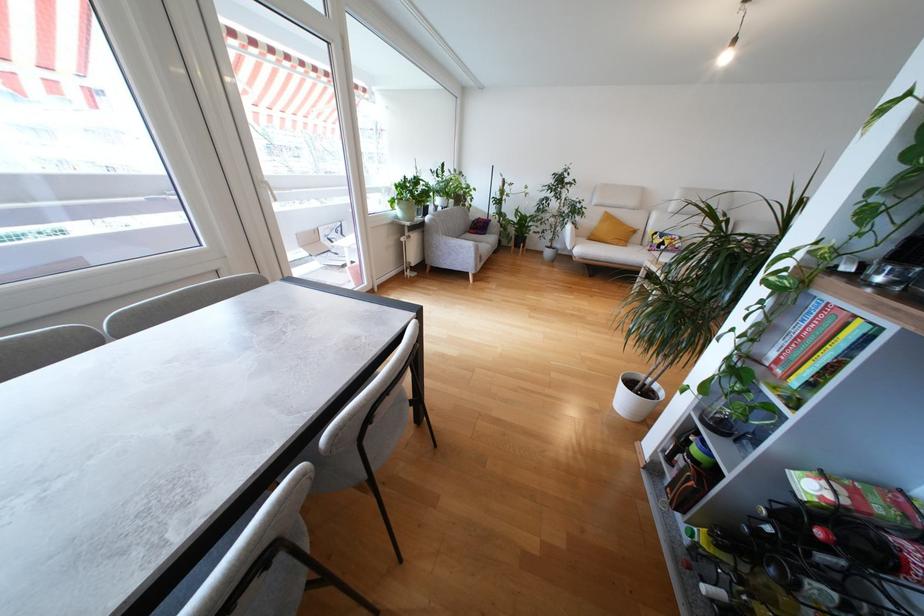
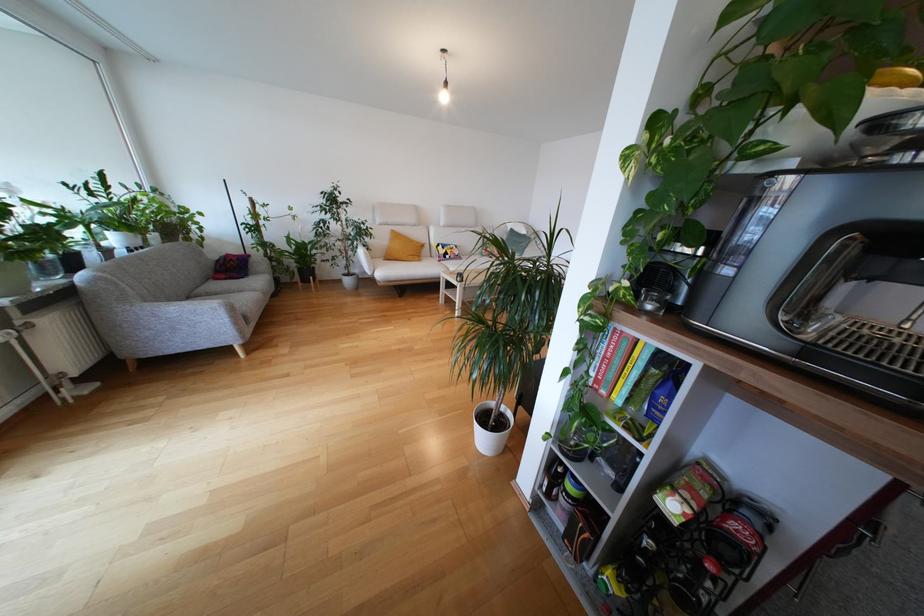
Find the pixel in the second image that matches (x=661, y=252) in the first image.

(448, 262)